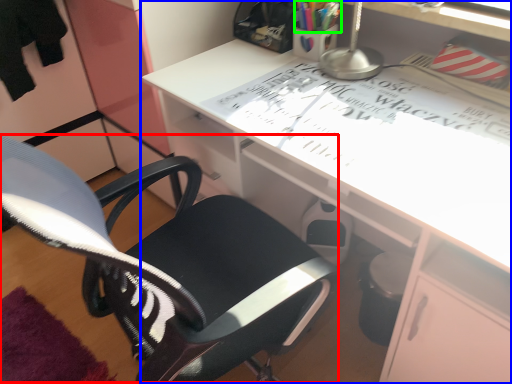
Question: Based on their relative distances, which object is nearer to computer chair (highlighted by a red box)? Choose from desk (highlighted by a blue box) and stationery (highlighted by a green box).

Choices:
 (A) desk
 (B) stationery

Answer: (A)